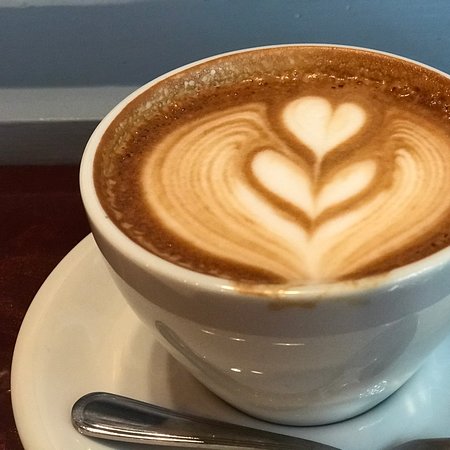
This screenshot has height=450, width=450. Identify the location of dark wood counter. (45, 226).